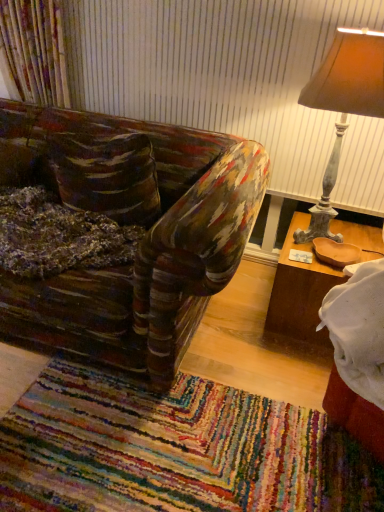
Question: From a real-world perspective, is wooden tray at right positioned above or below matte brown lampshade at upper right?

Choices:
 (A) below
 (B) above

Answer: (A)

Question: Which is correct: wooden tray at right is inside matte brown lampshade at upper right, or outside of it?

Choices:
 (A) outside
 (B) inside

Answer: (A)

Question: Considering the positions of point (274, 281) and point (336, 135), is point (274, 281) closer or farther from the camera than point (336, 135)?

Choices:
 (A) closer
 (B) farther

Answer: (A)

Question: From a real-world perspective, is matte brown lampshade at upper right positioned above or below wooden tray at right?

Choices:
 (A) below
 (B) above

Answer: (B)

Question: From the image's perspective, is matte brown lampshade at upper right positioned above or below wooden tray at right?

Choices:
 (A) above
 (B) below

Answer: (A)

Question: Is point (331, 186) closer or farther from the camera than point (284, 333)?

Choices:
 (A) closer
 (B) farther

Answer: (B)

Question: In terms of size, does matte brown lampshade at upper right appear bigger or smaller than wooden tray at right?

Choices:
 (A) small
 (B) big

Answer: (B)